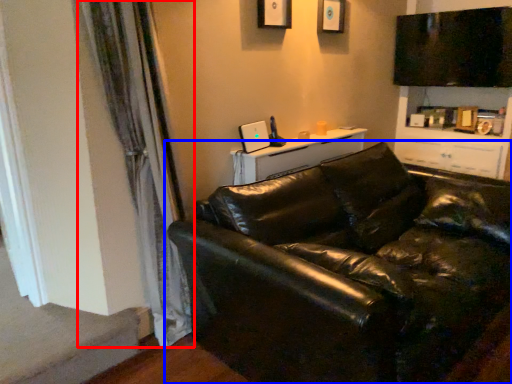
Question: Which point is further to the camera, curtain (highlighted by a red box) or studio couch (highlighted by a blue box)?

Choices:
 (A) curtain
 (B) studio couch

Answer: (A)